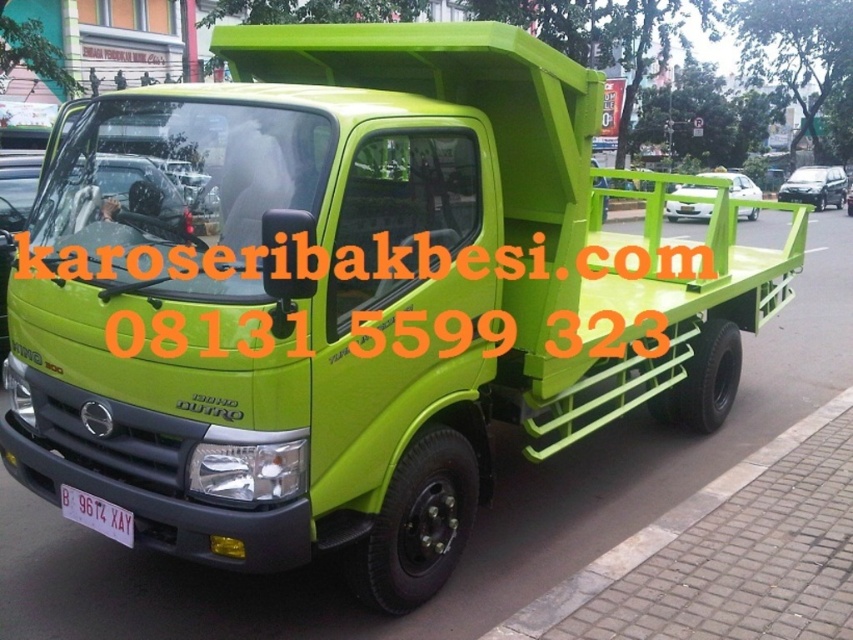
Question: Is matte green truck at center thinner than green matte truck at center?

Choices:
 (A) yes
 (B) no

Answer: (B)

Question: Among these points, which one is nearest to the camera?

Choices:
 (A) (94, 506)
 (B) (706, 188)
 (C) (817, 189)

Answer: (A)

Question: Estimate the real-world distances between objects in this image. Which object is farther from the matte green truck at center?

Choices:
 (A) green matte truck at center
 (B) white plastic license plate at center

Answer: (B)

Question: Which point is closer to the camera?

Choices:
 (A) matte green truck at center
 (B) green matte truck at center

Answer: (A)

Question: Is the position of matte green truck at center more distant than that of green matte truck at center?

Choices:
 (A) no
 (B) yes

Answer: (A)

Question: Can you confirm if matte green truck at center is positioned above green matte truck at center?

Choices:
 (A) yes
 (B) no

Answer: (B)